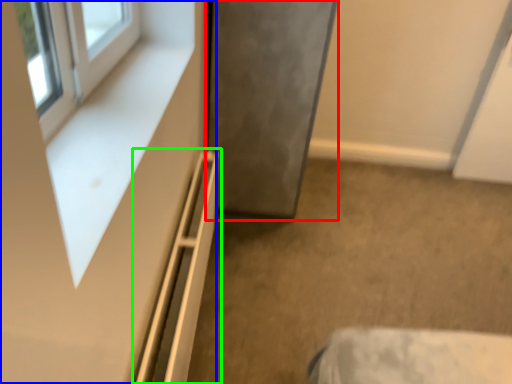
Question: Based on their relative distances, which object is nearer to door (highlighted by a red box)? Choose from dresser (highlighted by a blue box) and shelf (highlighted by a green box).

Choices:
 (A) dresser
 (B) shelf

Answer: (B)